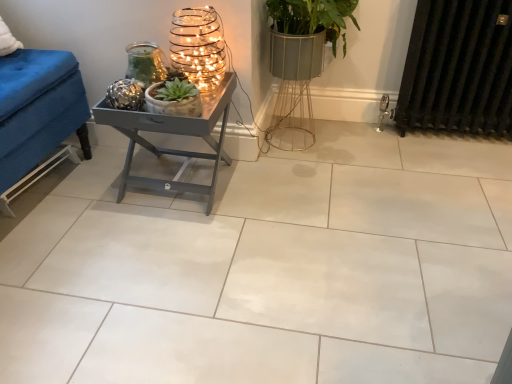
Question: Is black metal radiator at right looking in the opposite direction of metallic wire candle holder at upper left, arranged as the 1th candle holder when viewed from the right?

Choices:
 (A) yes
 (B) no

Answer: (B)

Question: From a real-world perspective, does black metal radiator at right sit lower than metallic wire candle holder at upper left, arranged as the 1th candle holder when viewed from the right?

Choices:
 (A) no
 (B) yes

Answer: (B)

Question: Considering the relative sizes of black metal radiator at right and metallic wire candle holder at upper left, arranged as the 1th candle holder when viewed from the right, in the image provided, is black metal radiator at right smaller than metallic wire candle holder at upper left, arranged as the 1th candle holder when viewed from the right,?

Choices:
 (A) no
 (B) yes

Answer: (A)

Question: Is black metal radiator at right oriented towards metallic wire candle holder at upper left, arranged as the 2th candle holder when viewed from the left?

Choices:
 (A) no
 (B) yes

Answer: (A)

Question: From the image's perspective, is black metal radiator at right over metallic wire candle holder at upper left, arranged as the 1th candle holder when viewed from the right?

Choices:
 (A) no
 (B) yes

Answer: (B)

Question: Can you confirm if black metal radiator at right is taller than metallic wire candle holder at upper left, arranged as the 1th candle holder when viewed from the right?

Choices:
 (A) no
 (B) yes

Answer: (B)

Question: Is metallic wire candle holder at upper left, arranged as the 1th candle holder when viewed from the right, closer to the viewer compared to black metal radiator at right?

Choices:
 (A) yes
 (B) no

Answer: (A)

Question: Considering the relative sizes of metallic wire candle holder at upper left, arranged as the 2th candle holder when viewed from the left, and black metal radiator at right in the image provided, is metallic wire candle holder at upper left, arranged as the 2th candle holder when viewed from the left, shorter than black metal radiator at right?

Choices:
 (A) no
 (B) yes

Answer: (B)

Question: Is metallic wire candle holder at upper left, arranged as the 2th candle holder when viewed from the left, next to black metal radiator at right and touching it?

Choices:
 (A) no
 (B) yes

Answer: (A)

Question: From a real-world perspective, does metallic wire candle holder at upper left, arranged as the 1th candle holder when viewed from the right, stand above black metal radiator at right?

Choices:
 (A) yes
 (B) no

Answer: (A)

Question: Is metallic wire candle holder at upper left, arranged as the 2th candle holder when viewed from the left, further to the viewer compared to black metal radiator at right?

Choices:
 (A) yes
 (B) no

Answer: (B)

Question: Does metallic wire candle holder at upper left, arranged as the 2th candle holder when viewed from the left, have a smaller size compared to black metal radiator at right?

Choices:
 (A) yes
 (B) no

Answer: (A)

Question: Considering the relative sizes of metallic textured candle holder at upper center, marked as the first candle holder in a left-to-right arrangement, and black metal radiator at right in the image provided, is metallic textured candle holder at upper center, marked as the first candle holder in a left-to-right arrangement, wider than black metal radiator at right?

Choices:
 (A) no
 (B) yes

Answer: (A)